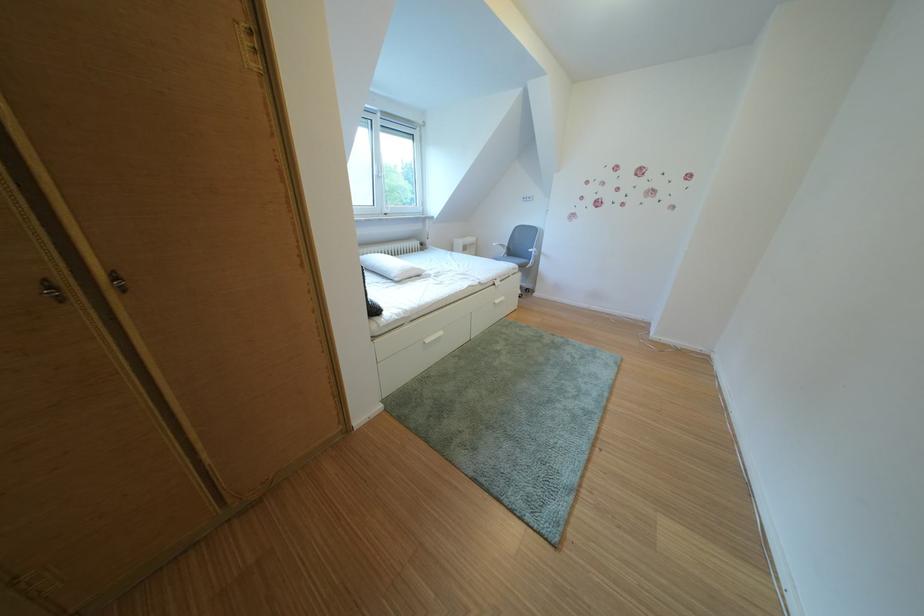
Image resolution: width=924 pixels, height=616 pixels. In order to click on chair armrest in this screenshot , I will do `click(500, 246)`.